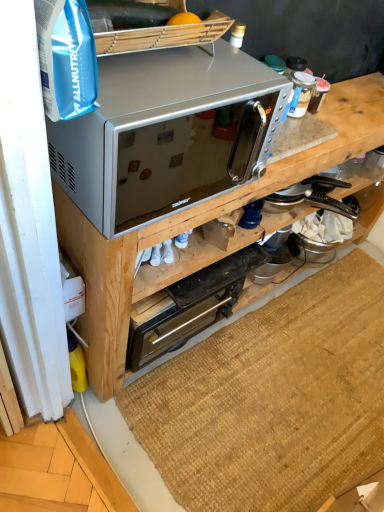
Question: From a real-world perspective, is satin silver microwave at upper center above or below silver metallic microwave at upper center?

Choices:
 (A) above
 (B) below

Answer: (A)

Question: Is satin silver microwave at upper center bigger or smaller than silver metallic microwave at upper center?

Choices:
 (A) big
 (B) small

Answer: (B)

Question: Which of these objects is positioned farthest from the brown woven mat at lower center?

Choices:
 (A) satin silver microwave at upper center
 (B) silver metallic microwave at upper center
 (C) metallic stainless steel toaster oven at center

Answer: (A)

Question: Estimate the real-world distances between objects in this image. Which object is farther from the silver metallic microwave at upper center?

Choices:
 (A) satin silver microwave at upper center
 (B) brown woven mat at lower center
 (C) metallic stainless steel toaster oven at center

Answer: (B)